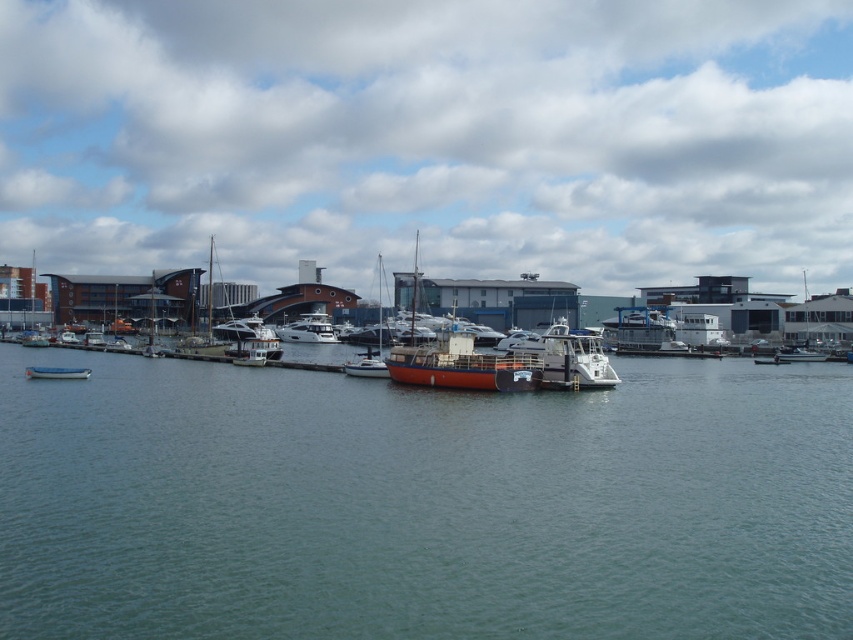
You are a photographer positioned at the center of the marina. You want to capture a photo of the white glossy yacht at center. What are the coordinates where you should aim your camera?

The white glossy yacht at center is located at coordinates point [308,330]. So you should aim your camera at point [308,330] to capture the white glossy yacht at center.

You are a dock worker who needs to move the white glossy yacht at center and the metallic silver boat at lower left into a storage area. The storage area can only accommodate vessels up to the size of the smaller boat. Which boat should you move first to ensure both fit?

You should move the metallic silver boat at lower left first because the white glossy yacht at center is wider than the metallic silver boat at lower left, so moving the smaller one first allows space for the larger yacht to be stored afterward.